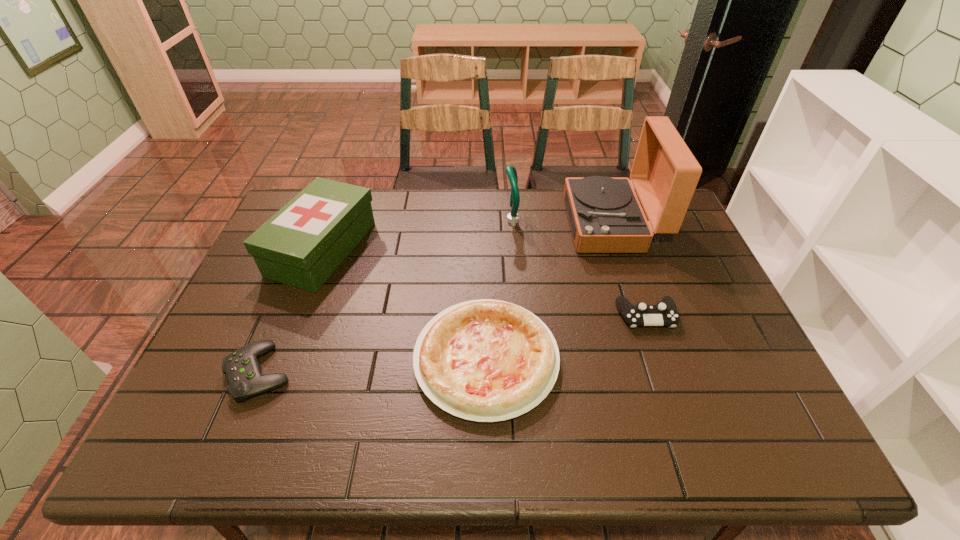
Locate an element on the screen. This screenshot has width=960, height=540. free spot located 0.390m on the face of the phonograph record is located at coordinates (449, 224).

Locate an element on the screen. blank space located 0.310m at the jaws of the bottle opener is located at coordinates (410, 220).

In order to click on free spot located at the jaws of the bottle opener in this screenshot , I will do `click(403, 220)`.

Where is `vacant area situated at the jaws of the bottle opener`? The image size is (960, 540). vacant area situated at the jaws of the bottle opener is located at coordinates (397, 220).

This screenshot has height=540, width=960. Find the location of `free region located on the front of the first-aid kit`. free region located on the front of the first-aid kit is located at coordinates (291, 332).

Locate an element on the screen. free spot located 0.330m on the back of the pizza is located at coordinates (485, 229).

In order to click on vacant region located on the surface of the farther control in this screenshot , I will do `click(693, 450)`.

This screenshot has height=540, width=960. In order to click on vacant region located 0.360m on the back of the nearer control in this screenshot , I will do `click(310, 249)`.

Where is `phonograph record located at the far edge`? This screenshot has height=540, width=960. phonograph record located at the far edge is located at coordinates (605, 215).

The height and width of the screenshot is (540, 960). In order to click on bottle opener at the far edge in this screenshot , I will do `click(510, 170)`.